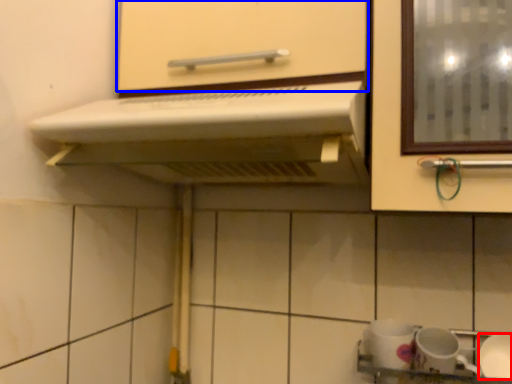
Question: Among these objects, which one is farthest to the camera, tableware (highlighted by a red box) or cabinetry (highlighted by a blue box)?

Choices:
 (A) tableware
 (B) cabinetry

Answer: (A)